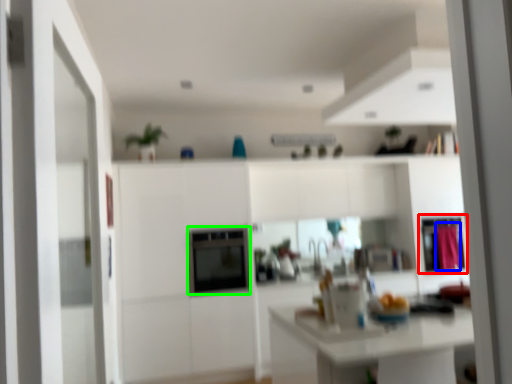
Question: Which object is positioned farthest from cabinetry (highlighted by a red box)? Select from curtain (highlighted by a blue box) and appliance (highlighted by a green box).

Choices:
 (A) curtain
 (B) appliance

Answer: (B)